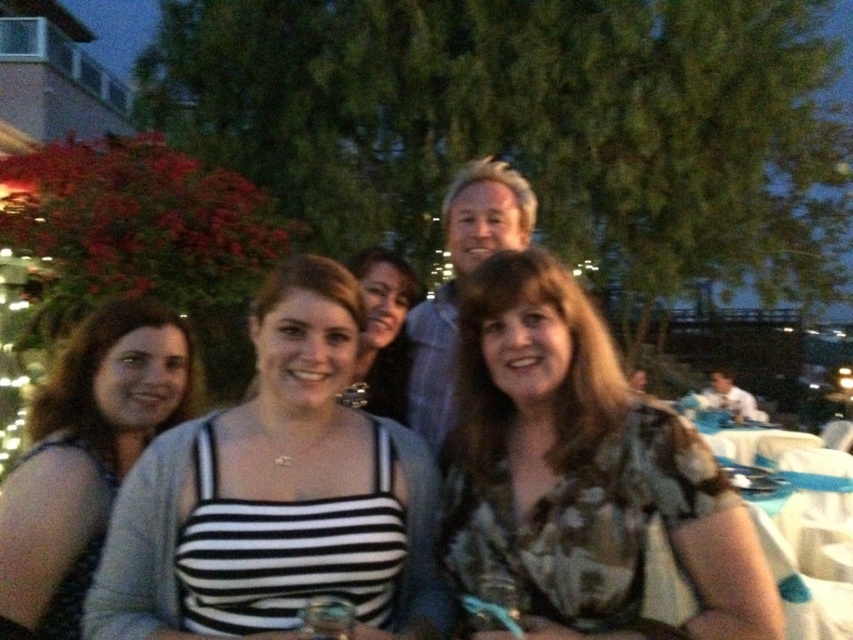
Which of these two, matte black tank top at left or matte black tank top at center, stands shorter?

matte black tank top at center is shorter.

Where is `matte black tank top at left`? Image resolution: width=853 pixels, height=640 pixels. matte black tank top at left is located at coordinates (85, 458).

Can you confirm if black striped tank top at center is positioned below matte black tank top at left?

No, black striped tank top at center is not below matte black tank top at left.

Between black striped tank top at center and matte black tank top at left, which one is positioned lower?

Positioned lower is matte black tank top at left.

Image resolution: width=853 pixels, height=640 pixels. What are the coordinates of `black striped tank top at center` in the screenshot? It's located at (277, 497).

Between point (271, 356) and point (403, 387), which one is positioned in front?

Point (271, 356) is more forward.

Who is shorter, black striped tank top at center or matte black tank top at center?

matte black tank top at center is shorter.

Is point (375, 454) positioned behind point (412, 282)?

No, it is not.

I want to click on black striped tank top at center, so pos(277,497).